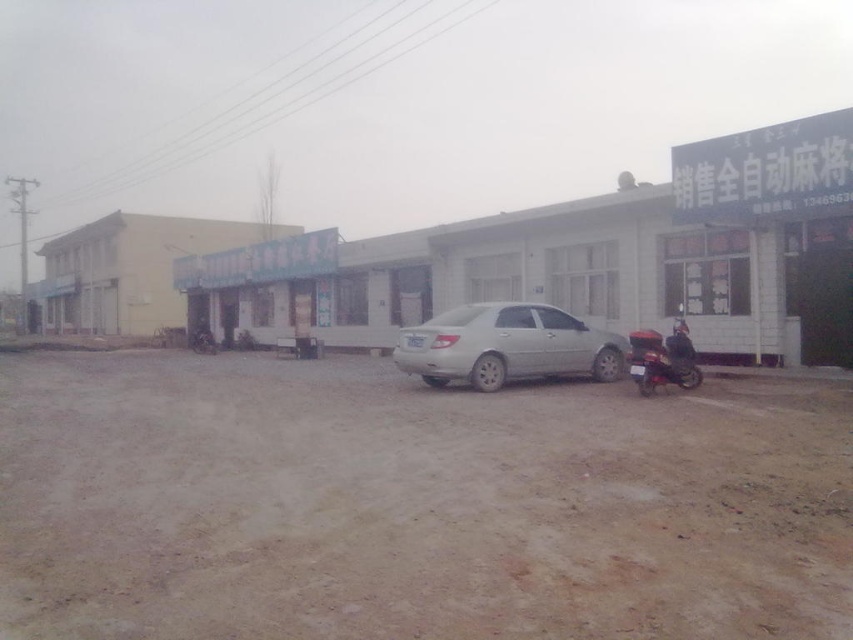
Between point (550, 330) and point (691, 381), which one is positioned behind?

The point (550, 330) is more distant.

What are the coordinates of `silver metallic car at center` in the screenshot? It's located at (506, 346).

I want to click on silver metallic car at center, so click(x=506, y=346).

Who is more distant from viewer, (640,451) or (538,362)?

The point (538,362) is behind.

Consider the image. Can you confirm if brown sandy dirt track at lower center is shorter than silver metallic car at center?

Incorrect, brown sandy dirt track at lower center's height does not fall short of silver metallic car at center's.

Which is behind, point (41, 477) or point (520, 305)?

Point (520, 305)

At what (x,y) coordinates should I click in order to perform the action: click on brown sandy dirt track at lower center. Please return your answer as a coordinate pair (x, y). Looking at the image, I should click on (412, 506).

Is brown sandy dirt track at lower center bigger than metallic red scooter at right?

Yes, brown sandy dirt track at lower center is bigger than metallic red scooter at right.

Does point (360, 493) come closer to viewer compared to point (700, 371)?

Yes, point (360, 493) is closer to viewer.

Locate an element on the screen. This screenshot has width=853, height=640. brown sandy dirt track at lower center is located at coordinates (412, 506).